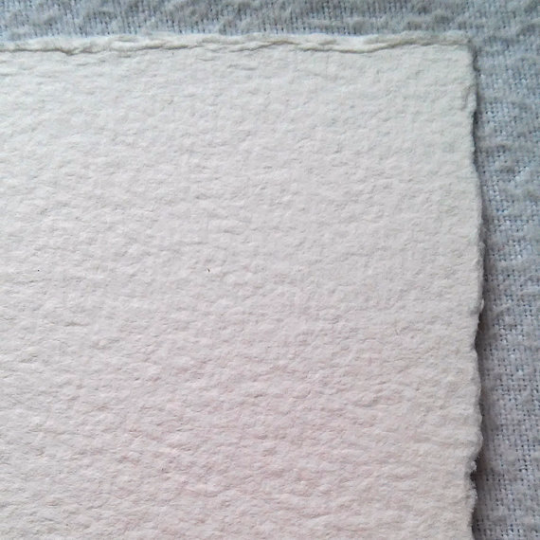
Where is `grey fabric`? The image size is (540, 540). grey fabric is located at coordinates (510, 79).